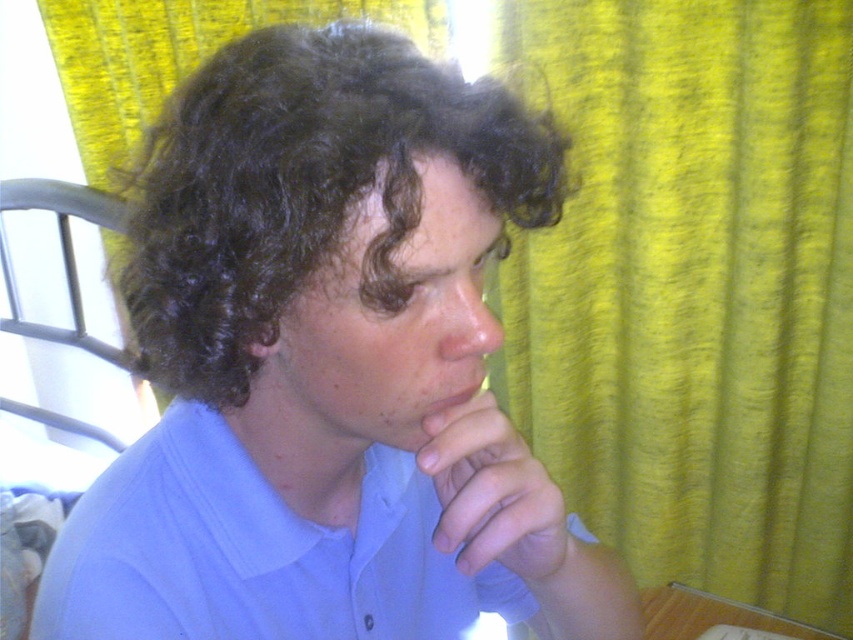
Which is more to the left, light blue cotton shirt at center or smooth skin nose at center?

light blue cotton shirt at center

Image resolution: width=853 pixels, height=640 pixels. Identify the location of light blue cotton shirt at center. (254, 552).

Find the location of `light blue cotton shirt at center`. light blue cotton shirt at center is located at coordinates (254, 552).

This screenshot has height=640, width=853. What do you see at coordinates (254, 552) in the screenshot?
I see `light blue cotton shirt at center` at bounding box center [254, 552].

Which of these two, light blue cotton shirt at center or matte skin mouth at center, stands shorter?

With less height is matte skin mouth at center.

This screenshot has width=853, height=640. What are the coordinates of `light blue cotton shirt at center` in the screenshot? It's located at (254, 552).

Identify the location of light blue cotton shirt at center. The height and width of the screenshot is (640, 853). (254, 552).

Which is more to the right, dark curly hair at center or smooth skin nose at center?

smooth skin nose at center

Which is in front, point (390, 177) or point (497, 284)?

Positioned in front is point (390, 177).

What do you see at coordinates (303, 188) in the screenshot? This screenshot has height=640, width=853. I see `dark curly hair at center` at bounding box center [303, 188].

Find the location of a particular element. Image resolution: width=853 pixels, height=640 pixels. dark curly hair at center is located at coordinates (303, 188).